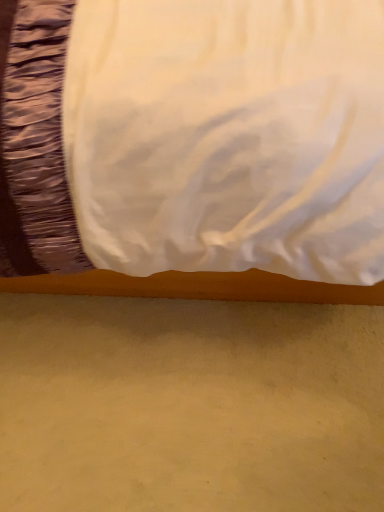
The height and width of the screenshot is (512, 384). Describe the element at coordinates (198, 136) in the screenshot. I see `satin white pillow at upper center` at that location.

Identify the location of satin white pillow at upper center. The width and height of the screenshot is (384, 512). (198, 136).

The height and width of the screenshot is (512, 384). What are the coordinates of `satin white pillow at upper center` in the screenshot? It's located at (198, 136).